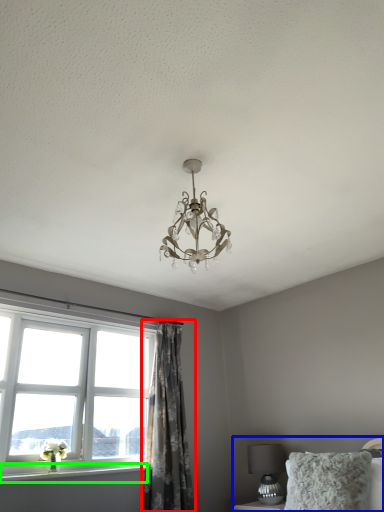
Question: Estimate the real-world distances between objects in this image. Which object is farther from curtain (highlighted by a red box), bed (highlighted by a blue box) or window sill (highlighted by a green box)?

Choices:
 (A) bed
 (B) window sill

Answer: (A)